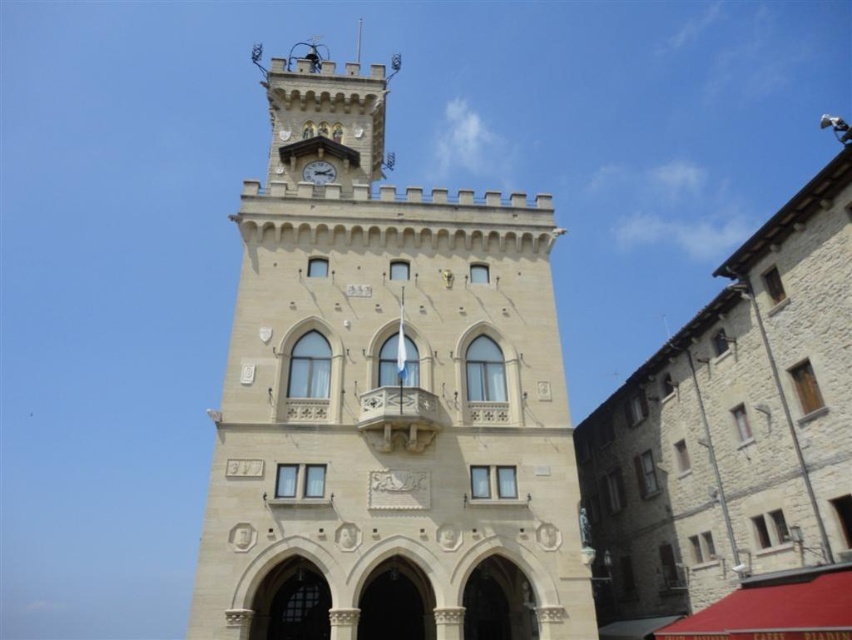
You are a maintenance worker needing to reach the metallic clock at center from the beige stone clock tower at center. Given that your ladder can extend up to 12 meters, will the ladder be sufficient to bridge the gap between them?

The distance between the beige stone clock tower at center and the metallic clock at center is 12.51 meters, which exceeds the ladder length of 12 meters. Therefore, the ladder will not be sufficient to bridge the gap between them.

Consider the image. You are standing at the entrance of the historic building and want to locate two points marked in the image. The first point is at coordinates point (275, 410) and the second is at point (309, 177). Which of these points is closer to you as you face the building?

Point (275, 410) is in front of point (309, 177), so the first point is closer to you as you face the building.